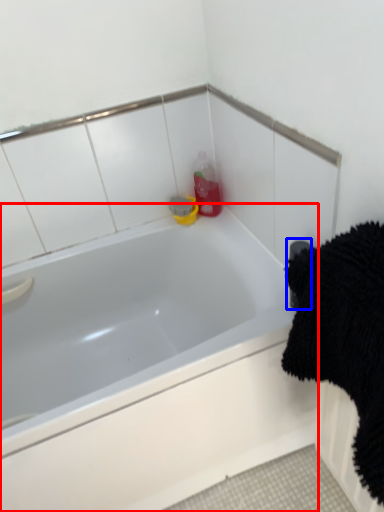
Question: Which point is further to the camera, bathtub (highlighted by a red box) or towel bar (highlighted by a blue box)?

Choices:
 (A) bathtub
 (B) towel bar

Answer: (B)